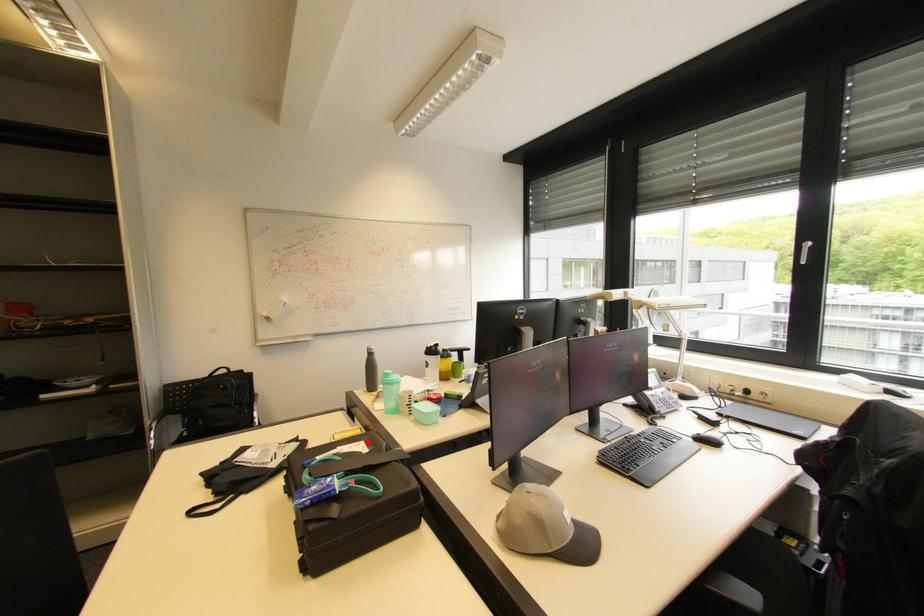
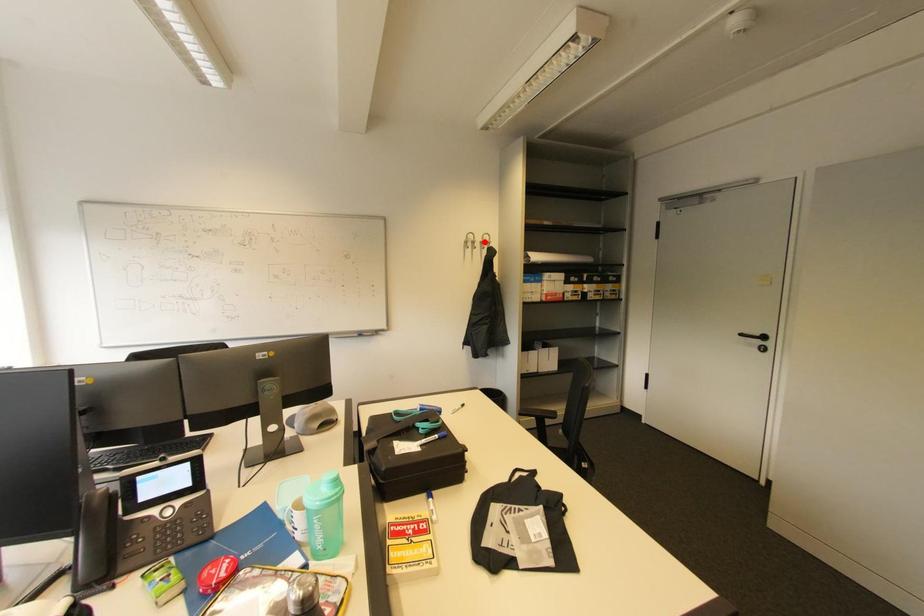
I am providing you with two images of the same scene from different viewpoints. A red point is marked on the first image and another point is marked on the second image. Do the highlighted points in image1 and image2 indicate the same real-world spot?

No